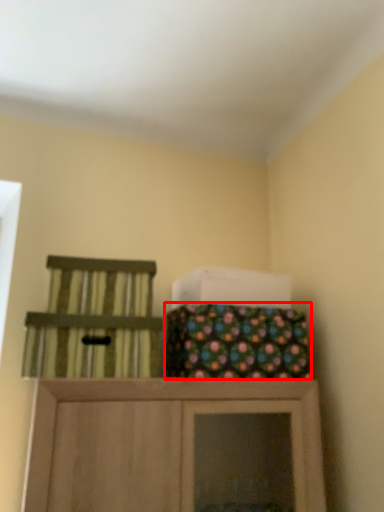
Question: From the image's perspective, considering the relative positions of material (annotated by the red box) and chair in the image provided, where is material (annotated by the red box) located with respect to the staircase?

Choices:
 (A) above
 (B) below

Answer: (A)